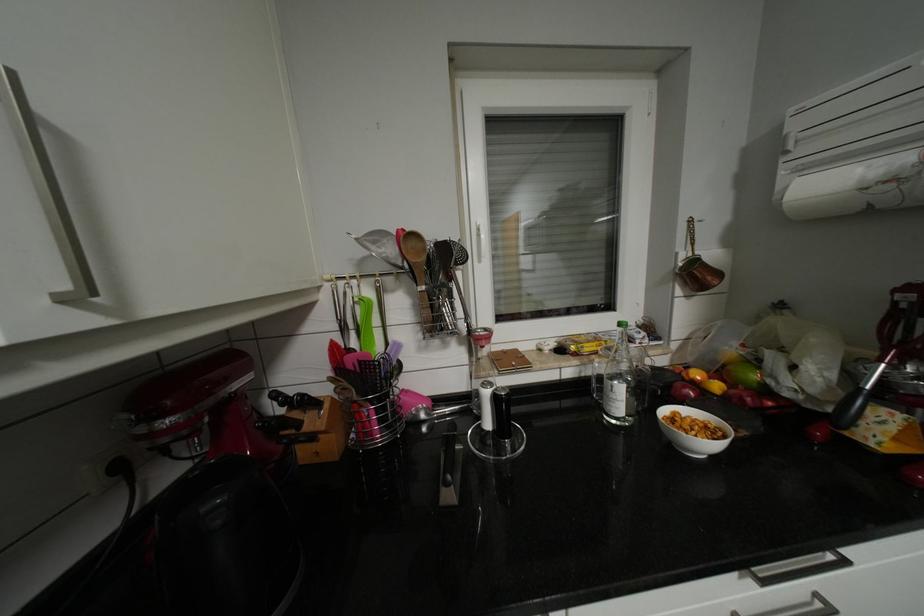
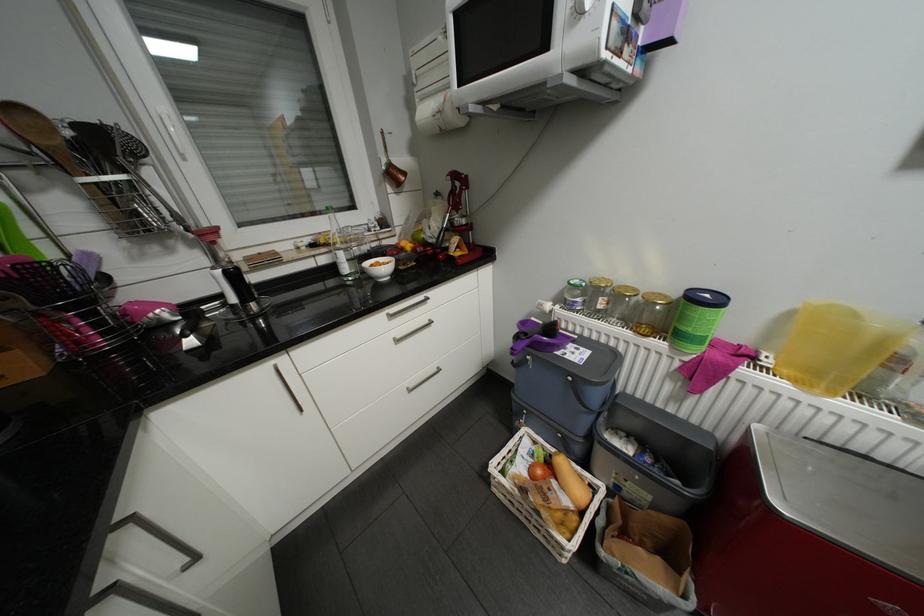
The first image is from the beginning of the video and the second image is from the end. How did the camera likely rotate when shooting the video?

The camera's rotation is toward right-down.